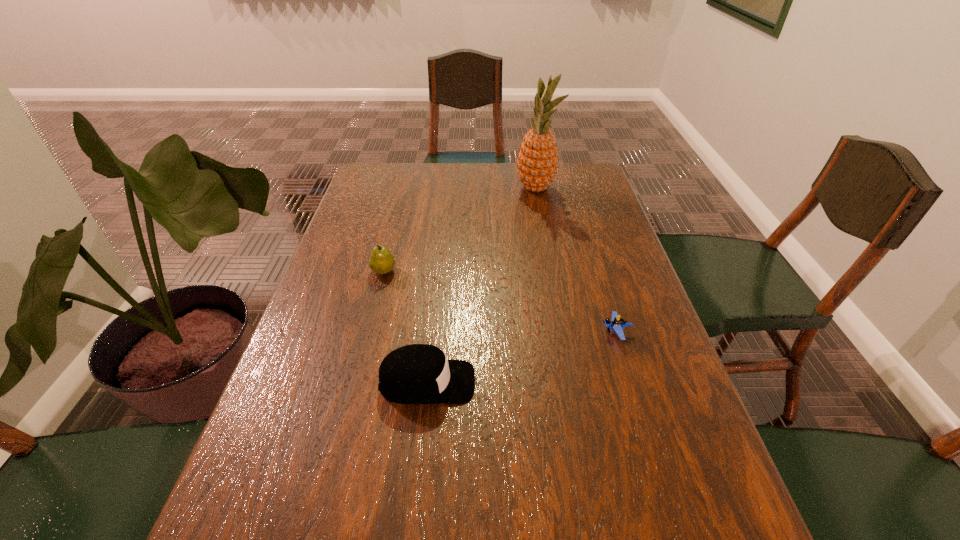
The width and height of the screenshot is (960, 540). In order to click on the tallest object in this screenshot , I will do `click(537, 161)`.

You are a GUI agent. You are given a task and a screenshot of the screen. Output one action in this format:
    pyautogui.click(x=<x>, y=<y>)
    Task: Click on the second object from right to left
    This screenshot has width=960, height=540.
    Given the screenshot: What is the action you would take?
    pyautogui.click(x=537, y=161)

Where is `the leftmost object`? The width and height of the screenshot is (960, 540). the leftmost object is located at coordinates (381, 261).

The width and height of the screenshot is (960, 540). I want to click on the third nearest object, so click(381, 261).

The image size is (960, 540). In order to click on cap in this screenshot , I will do `click(418, 373)`.

Where is `the second object from left to right`? the second object from left to right is located at coordinates (418, 373).

You are a GUI agent. You are given a task and a screenshot of the screen. Output one action in this format:
    pyautogui.click(x=<x>, y=<y>)
    Task: Click on the rightmost object
    
    Given the screenshot: What is the action you would take?
    pyautogui.click(x=616, y=324)

You are a GUI agent. You are given a task and a screenshot of the screen. Output one action in this format:
    pyautogui.click(x=<x>, y=<y>)
    Task: Click on the Lego
    This screenshot has height=540, width=960.
    Given the screenshot: What is the action you would take?
    pyautogui.click(x=616, y=324)

Locate an element on the screen. vacant space located on the right of the second object from right to left is located at coordinates (574, 188).

What are the coordinates of `free region located 0.170m on the right of the pear` in the screenshot? It's located at (460, 271).